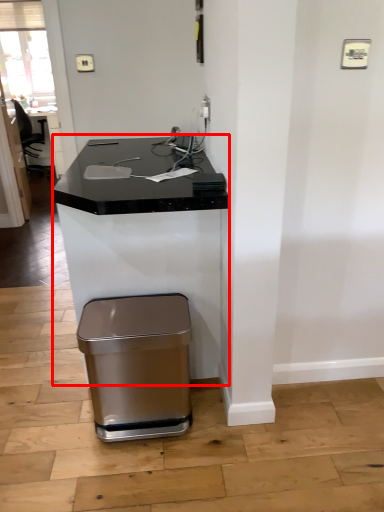
Question: From the image's perspective, where is computer desk (annotated by the red box) located relative to waste container?

Choices:
 (A) below
 (B) above

Answer: (B)